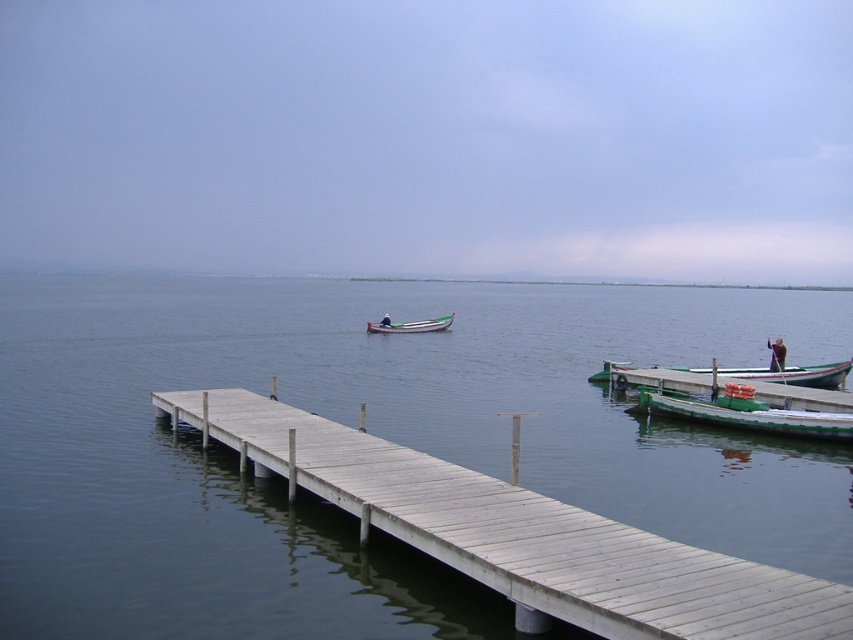
Is green wooden boat at right below dark blue fabric at center?

Correct, green wooden boat at right is located below dark blue fabric at center.

In order to click on green wooden boat at right in this screenshot , I will do `click(793, 374)`.

Who is positioned more to the right, green wooden boat at right or green wooden boat at center?

green wooden boat at right is more to the right.

Who is lower down, green wooden boat at right or green wooden boat at center?

green wooden boat at right is below.

Where is `green wooden boat at right`? Image resolution: width=853 pixels, height=640 pixels. green wooden boat at right is located at coordinates (793, 374).

Is green matte boat at lower right shorter than dark blue fabric at center?

Yes, green matte boat at lower right is shorter than dark blue fabric at center.

Does green matte boat at lower right have a larger size compared to dark blue fabric at center?

Indeed, green matte boat at lower right has a larger size compared to dark blue fabric at center.

Image resolution: width=853 pixels, height=640 pixels. What do you see at coordinates (747, 413) in the screenshot?
I see `green matte boat at lower right` at bounding box center [747, 413].

This screenshot has width=853, height=640. What are the coordinates of `green matte boat at lower right` in the screenshot? It's located at (747, 413).